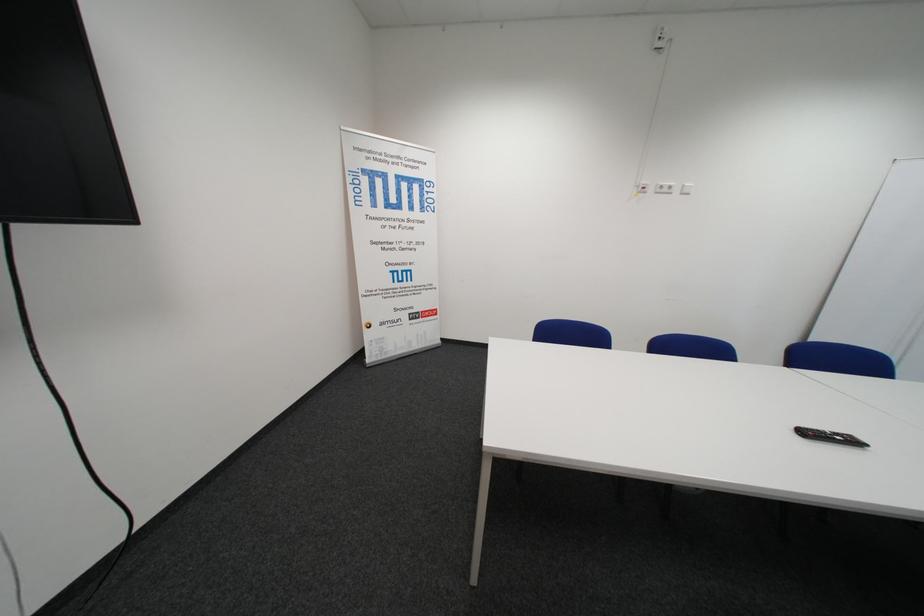
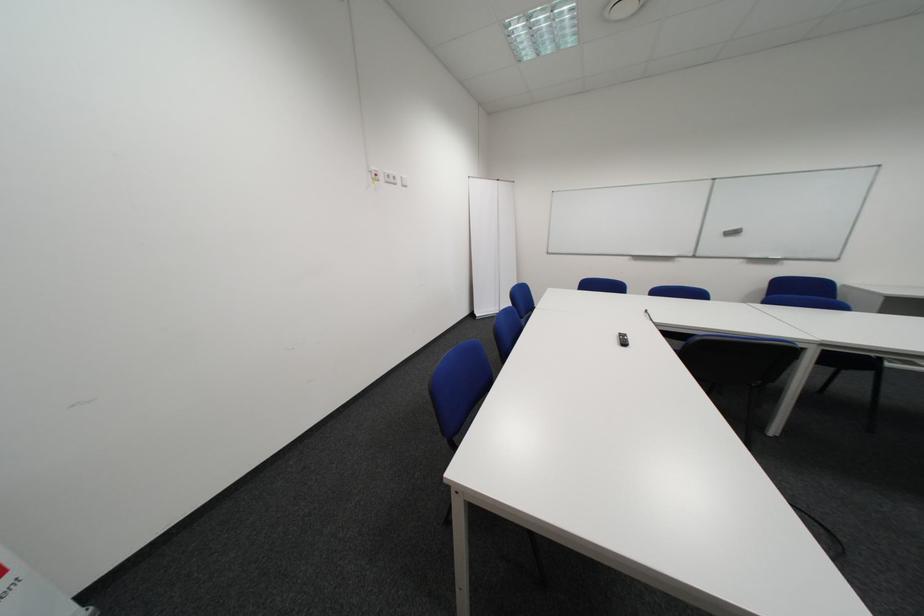
The point at (683,188) is marked in the first image. Where is the corresponding point in the second image?

(407, 179)